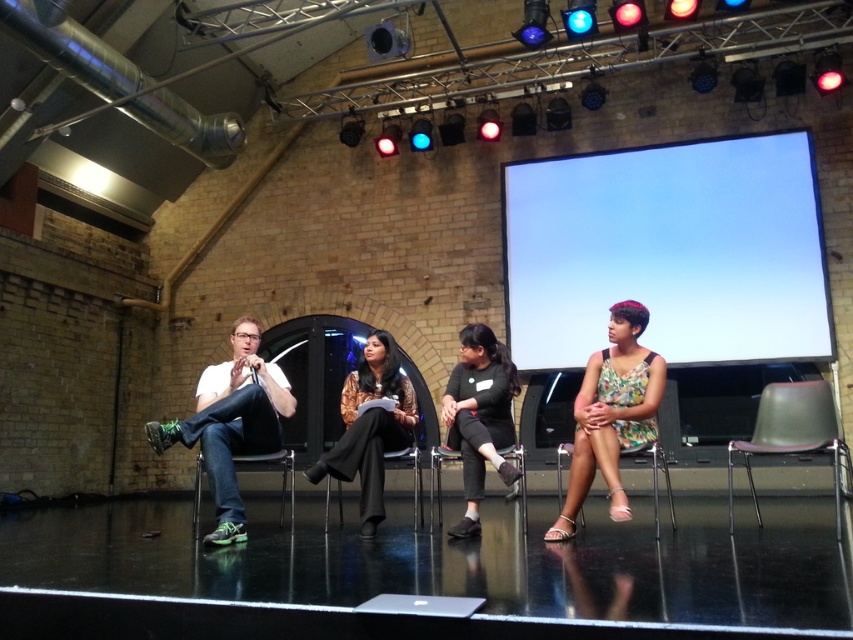
Question: Is metallic gray chair at right closer to camera compared to denim fabric chair at left?

Choices:
 (A) yes
 (B) no

Answer: (A)

Question: Among these objects, which one is farthest from the camera?

Choices:
 (A) metallic silver chair at center
 (B) metallic gray chair at right

Answer: (A)

Question: Among these points, which one is farthest from the camera?

Choices:
 (A) (277, 420)
 (B) (547, 531)
 (C) (730, 349)

Answer: (C)

Question: Does silver metallic laptop at lower center appear over metallic silver chair at center?

Choices:
 (A) yes
 (B) no

Answer: (B)

Question: Is black matte pants at center positioned before black fabric chair at center?

Choices:
 (A) yes
 (B) no

Answer: (A)

Question: Estimate the real-world distances between objects in this image. Which object is farther from the silver metallic laptop at lower center?

Choices:
 (A) black fabric chair at center
 (B) denim jeans at left

Answer: (B)